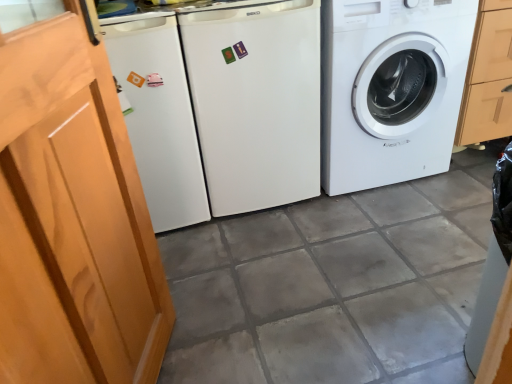
Question: Do you think white glossy washing machine at right, placed as the 2th washing machine when sorted from left to right, is within wooden screen door at left, or outside of it?

Choices:
 (A) inside
 (B) outside

Answer: (B)

Question: Looking at their shapes, would you say white glossy washing machine at right, placed as the 2th washing machine when sorted from left to right, is wider or thinner than wooden screen door at left?

Choices:
 (A) wide
 (B) thin

Answer: (A)

Question: Which object is the farthest from the white glossy washing machine at right, the first washing machine viewed from the right?

Choices:
 (A) white matte refrigerator at center, the first washing machine viewed from the left
 (B) wooden screen door at left

Answer: (B)

Question: Which of these objects is positioned farthest from the white matte refrigerator at center, the second washing machine positioned from the right?

Choices:
 (A) white glossy washing machine at right, placed as the 2th washing machine when sorted from left to right
 (B) wooden screen door at left

Answer: (B)